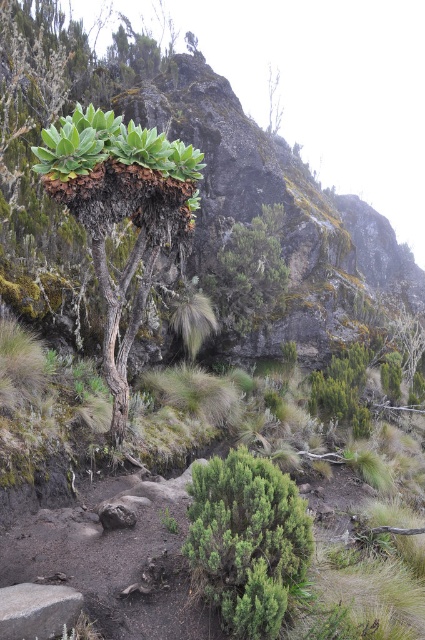
You are a botanist examining a mountainous area. You have a GPS coordinate that points to a green leafy plant at center. Based on the scene description, where would you expect to find this plant?

The green leafy plant at center is located at point (121, 212).

You are a botanist studying plants in this mountainous area. You need to locate the green leafy bush at center. Where exactly is it positioned in the image?

The green leafy bush at center is positioned at point coordinates of 0.845 on the x axis and 0.581 on the y axis.